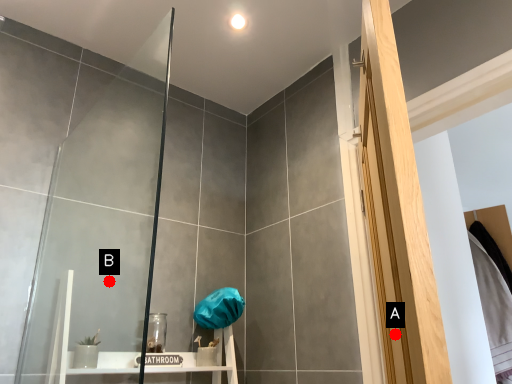
Question: Two points are circled on the image, labeled by A and B beside each circle. Which point is farther to the camera?

Choices:
 (A) A is further
 (B) B is further

Answer: (B)